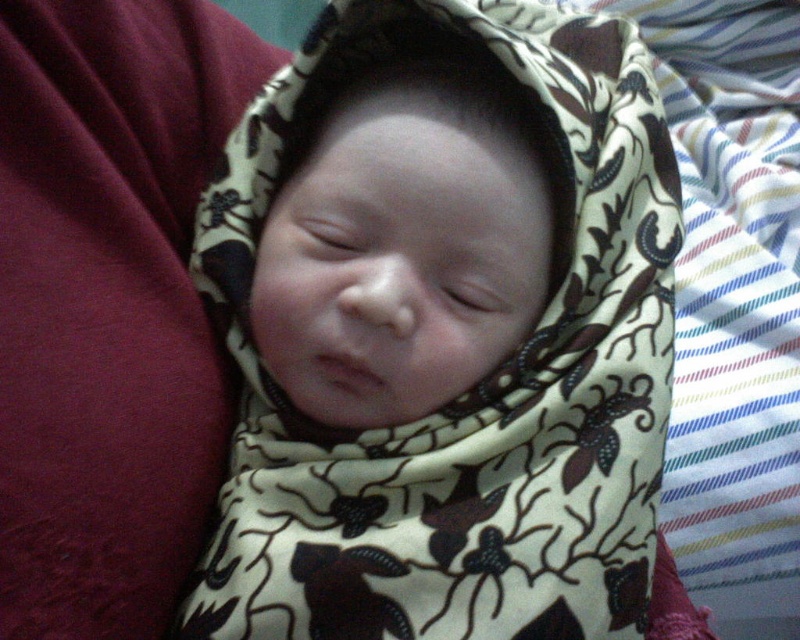
Describe the element at coordinates (490, 417) in the screenshot. I see `brown printed fabric at center` at that location.

Can you confirm if brown printed fabric at center is taller than smooth beige swaddle at center?

Correct, brown printed fabric at center is much taller as smooth beige swaddle at center.

Which is behind, point (536, 602) or point (516, 307)?

The point (516, 307) is behind.

Where is `brown printed fabric at center`? The image size is (800, 640). brown printed fabric at center is located at coordinates (490, 417).